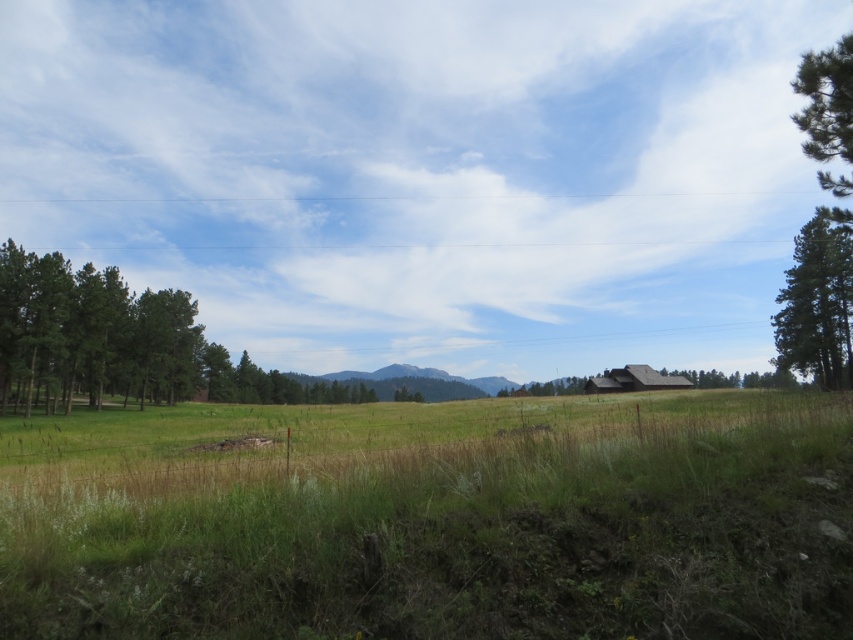
Question: Among these objects, which one is nearest to the camera?

Choices:
 (A) brown wooden hut at lower right
 (B) green textured pine tree at upper right
 (C) green grassy pasture at center

Answer: (C)

Question: Which object is closer to the camera taking this photo?

Choices:
 (A) brown wooden hut at lower right
 (B) green grassy pasture at center
 (C) green textured pine tree at upper right

Answer: (B)

Question: Which point is farther to the camera?

Choices:
 (A) (737, 416)
 (B) (798, 88)
 (C) (828, 337)

Answer: (C)

Question: In this image, where is green leafy tree at left located relative to green textured tree at right?

Choices:
 (A) above
 (B) below

Answer: (B)

Question: Is the position of green textured tree at right less distant than that of green textured pine tree at upper right?

Choices:
 (A) no
 (B) yes

Answer: (A)

Question: From the image, what is the correct spatial relationship of green grassy pasture at center in relation to green textured pine tree at upper right?

Choices:
 (A) above
 (B) below

Answer: (B)